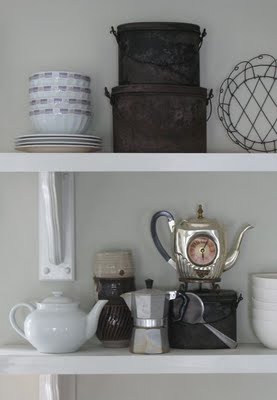
Find the location of a particular element. This screenshot has height=400, width=277. grey wall is located at coordinates (126, 188).